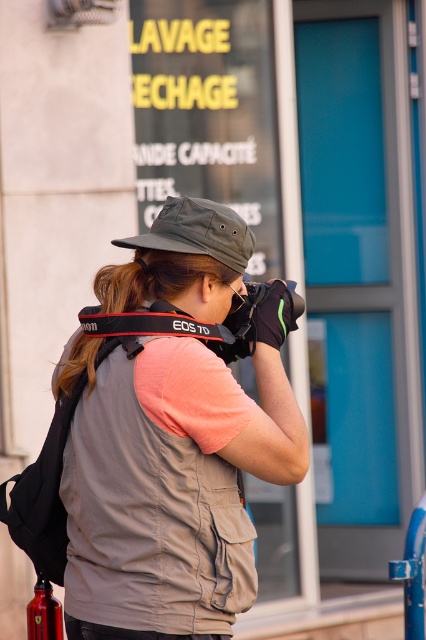
You are a photographer trying to adjust your camera settings. You notice the brown hair at center and the red fabric camera strap at center. Which one has a greater width?

The brown hair at center has a greater width than the red fabric camera strap at center.

You are a photographer looking at the scene. You notice the matte gray vest at center and the red fabric camera strap at center. Which item is located to the right of the other?

The matte gray vest at center is positioned on the right side of red fabric camera strap at center, so the matte gray vest at center is to the right of the red fabric camera strap at center.